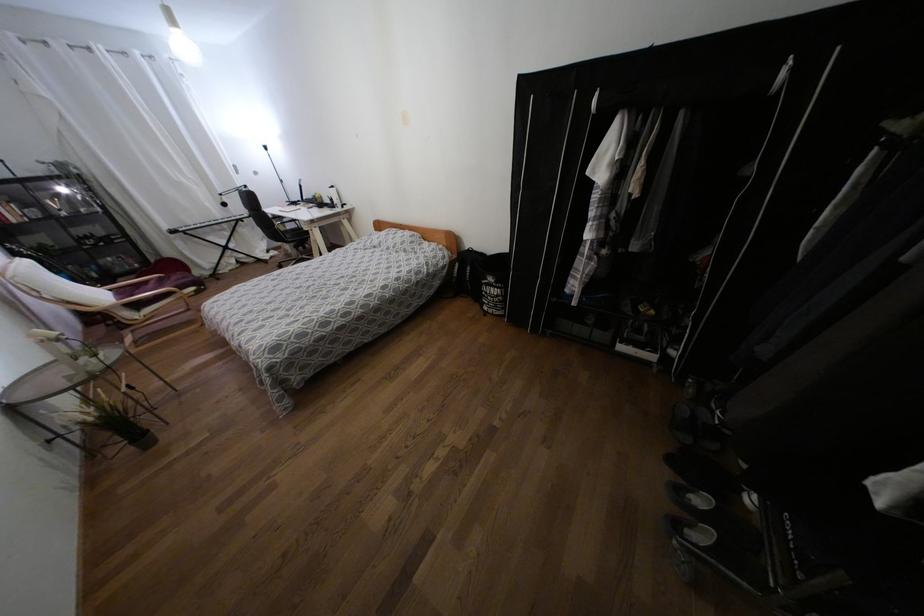
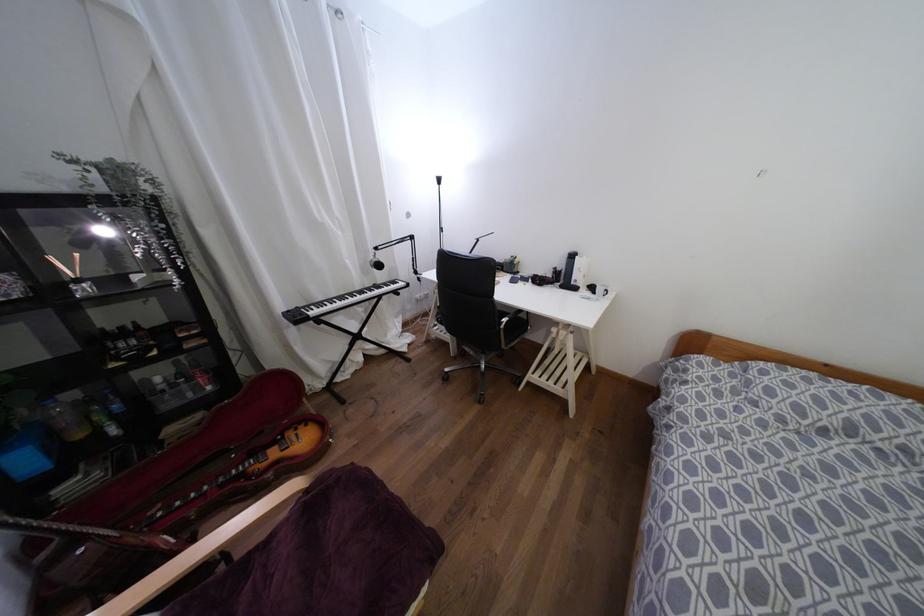
Which direction would the cameraman need to move to produce the second image?

The cameraman moved toward left, forward.